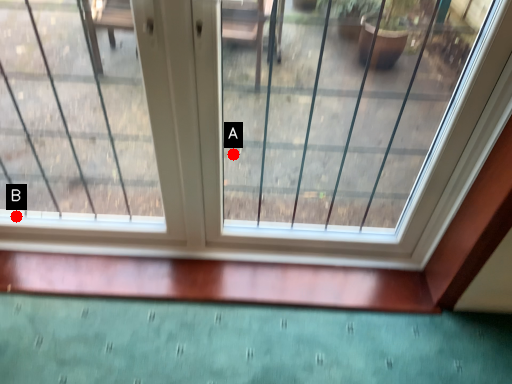
Question: Two points are circled on the image, labeled by A and B beside each circle. Among these points, which one is nearest to the camera?

Choices:
 (A) A is closer
 (B) B is closer

Answer: (B)